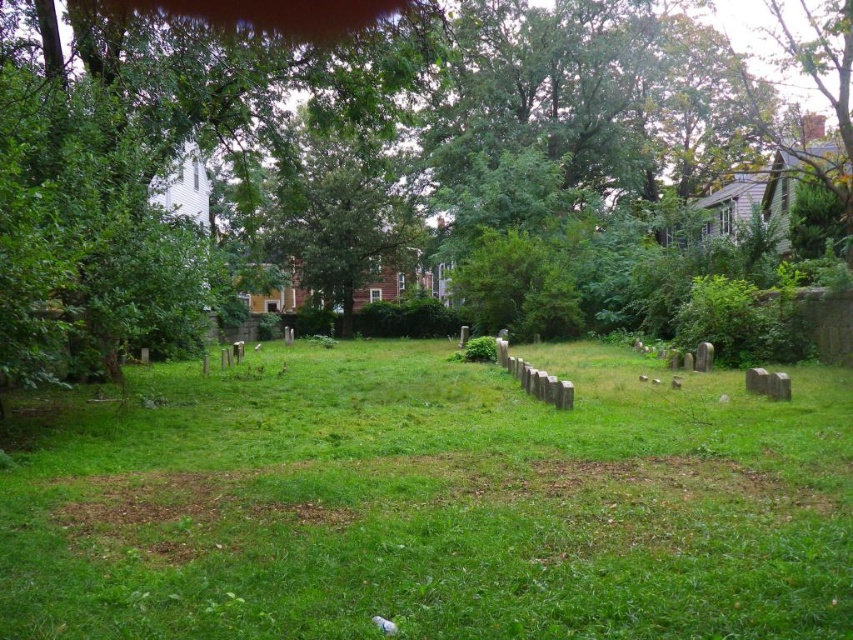
You are a gardener planning to mow the green grassy area at center and trim the green leafy tree at center in the cemetery. Which task requires more effort based on their sizes?

The green leafy tree at center requires more effort because it is thicker than the green grassy area at center.

You are standing in the cemetery and want to place a wreath on the green grassy area at center. To avoid damaging the green leafy tree at center, which direction should you approach from?

The green grassy area at center is located below the green leafy tree at center, so you should approach from the direction opposite to where the tree branches extend to avoid damaging them.